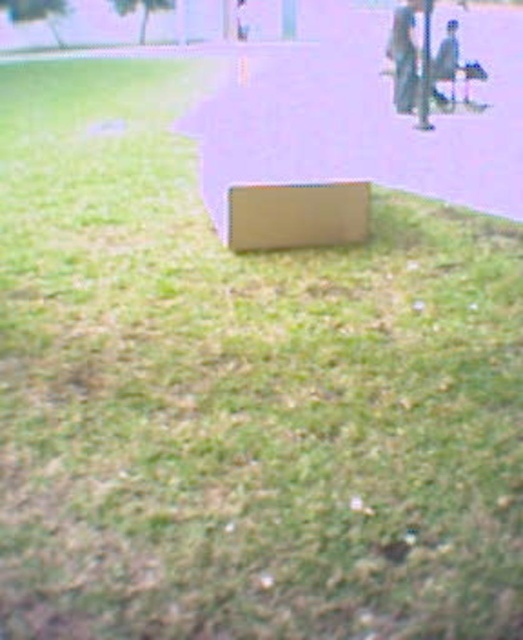
Looking at this image, who is positioned more to the left, brown cardboard at center or matte cardboard box at center?

matte cardboard box at center

Based on the photo, can you confirm if brown cardboard at center is shorter than matte cardboard box at center?

No.

This screenshot has height=640, width=523. Describe the element at coordinates (361, 115) in the screenshot. I see `brown cardboard at center` at that location.

Identify the location of brown cardboard at center. (x=361, y=115).

Who is more forward, (244, 212) or (395, 28)?

Point (244, 212) is in front.

Looking at this image, is matte cardboard box at center smaller than metallic silver skateboard at upper right?

Yes.

This screenshot has width=523, height=640. Find the location of `matte cardboard box at center`. matte cardboard box at center is located at coordinates (297, 216).

Where is `matte cardboard box at center`? matte cardboard box at center is located at coordinates (297, 216).

Who is lower down, brown cardboard at center or metallic silver skateboard at upper right?

metallic silver skateboard at upper right is lower down.

Does brown cardboard at center appear over metallic silver skateboard at upper right?

Correct, brown cardboard at center is located above metallic silver skateboard at upper right.

Who is more forward, (228, 182) or (396, 112)?

Positioned in front is point (228, 182).

The image size is (523, 640). What are the coordinates of `brown cardboard at center` in the screenshot? It's located at (361, 115).